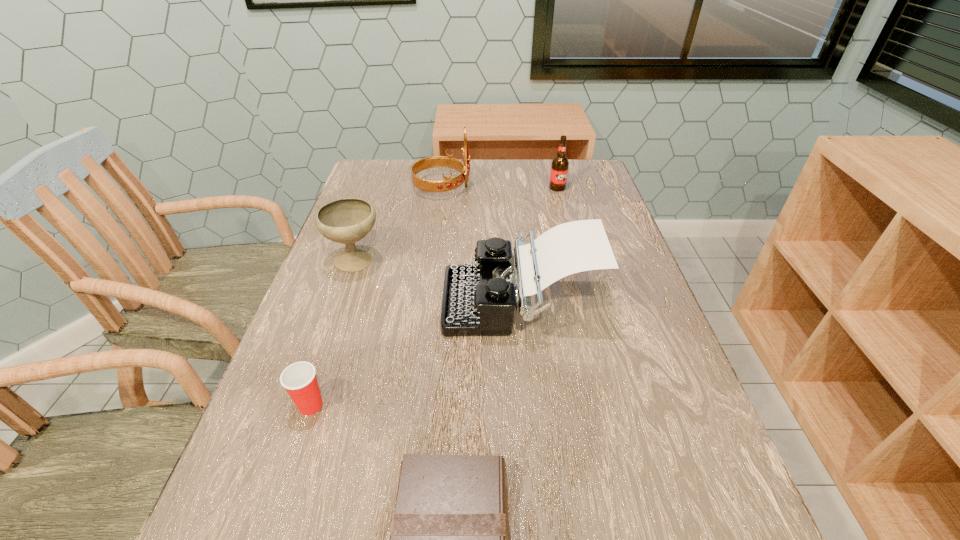
Where is `vacant position located on the left of the root beer`? vacant position located on the left of the root beer is located at coordinates (533, 188).

This screenshot has width=960, height=540. Identify the location of vacant region located 0.250m on the front of the chalice. (322, 366).

The width and height of the screenshot is (960, 540). In order to click on free space located 0.100m on the front of the fifth farthest object in this screenshot , I will do [287, 477].

This screenshot has height=540, width=960. In order to click on tiara that is at the far edge in this screenshot , I will do click(448, 184).

Locate an element on the screen. The height and width of the screenshot is (540, 960). root beer present at the far edge is located at coordinates (559, 169).

Find the location of a particular element. This screenshot has height=540, width=960. chalice situated at the left edge is located at coordinates (348, 220).

The height and width of the screenshot is (540, 960). I want to click on Dixie cup at the left edge, so [x=299, y=379].

The width and height of the screenshot is (960, 540). I want to click on typewriter that is positioned at the right edge, so click(478, 300).

Identify the location of root beer located in the right edge section of the desktop. (559, 169).

At what (x,y) coordinates should I click in order to perform the action: click on object at the far right corner. Please return your answer as a coordinate pair (x, y). Looking at the image, I should click on (559, 169).